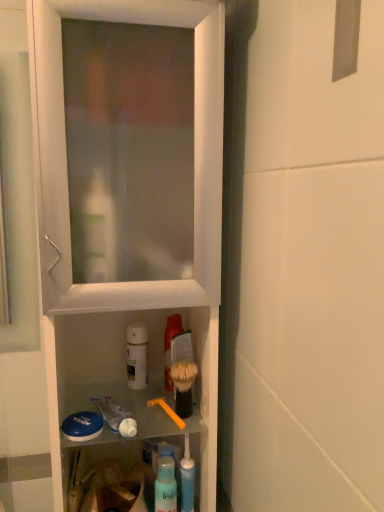
Question: Could you tell me if blue translucent toothpaste tube at lower center is facing translucent plastic mouthwash at center, which is counted as the 2th mouthwash, starting from the left?

Choices:
 (A) no
 (B) yes

Answer: (A)

Question: From the image's perspective, is blue translucent toothpaste tube at lower center located above translucent plastic mouthwash at center, which is counted as the 2th mouthwash, starting from the left?

Choices:
 (A) no
 (B) yes

Answer: (A)

Question: Does blue translucent toothpaste tube at lower center have a greater height compared to translucent plastic mouthwash at center, which is counted as the 2th mouthwash, starting from the left?

Choices:
 (A) yes
 (B) no

Answer: (A)

Question: From a real-world perspective, does blue translucent toothpaste tube at lower center sit lower than translucent plastic mouthwash at center, which is counted as the 2th mouthwash, starting from the left?

Choices:
 (A) yes
 (B) no

Answer: (A)

Question: Is blue translucent toothpaste tube at lower center shorter than translucent plastic mouthwash at center, placed as the first mouthwash when sorted from right to left?

Choices:
 (A) no
 (B) yes

Answer: (A)

Question: Is blue translucent toothpaste tube at lower center thinner than translucent plastic mouthwash at center, which is counted as the 2th mouthwash, starting from the left?

Choices:
 (A) yes
 (B) no

Answer: (A)

Question: From a real-world perspective, is white matte bottle at center, positioned as the first mouthwash in left-to-right order, on top of white plastic cabinet at center?

Choices:
 (A) no
 (B) yes

Answer: (A)

Question: From the image's perspective, is white matte bottle at center, which ranks as the second mouthwash in right-to-left order, over white plastic cabinet at center?

Choices:
 (A) yes
 (B) no

Answer: (B)

Question: Would you consider white matte bottle at center, positioned as the first mouthwash in left-to-right order, to be distant from white plastic cabinet at center?

Choices:
 (A) yes
 (B) no

Answer: (B)

Question: Considering the relative sizes of white matte bottle at center, which ranks as the second mouthwash in right-to-left order, and white plastic cabinet at center in the image provided, is white matte bottle at center, which ranks as the second mouthwash in right-to-left order, thinner than white plastic cabinet at center?

Choices:
 (A) yes
 (B) no

Answer: (A)

Question: Is white matte bottle at center, positioned as the first mouthwash in left-to-right order, taller than white plastic cabinet at center?

Choices:
 (A) no
 (B) yes

Answer: (A)

Question: Is white matte bottle at center, positioned as the first mouthwash in left-to-right order, to the right of white plastic cabinet at center from the viewer's perspective?

Choices:
 (A) yes
 (B) no

Answer: (A)

Question: Considering the relative sizes of translucent plastic mouthwash at center, placed as the first mouthwash when sorted from right to left, and blue translucent toothpaste tube at lower center in the image provided, is translucent plastic mouthwash at center, placed as the first mouthwash when sorted from right to left, bigger than blue translucent toothpaste tube at lower center?

Choices:
 (A) no
 (B) yes

Answer: (B)